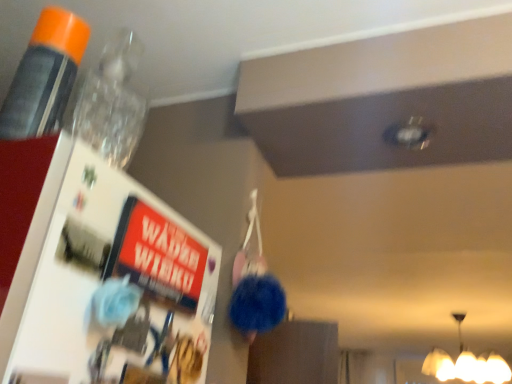
Question: Is matte white lampshade at lower right spatially inside orange cap plastic bottle at upper left, or outside of it?

Choices:
 (A) outside
 (B) inside

Answer: (A)

Question: Considering the positions of point (420, 370) and point (49, 107), is point (420, 370) closer or farther from the camera than point (49, 107)?

Choices:
 (A) closer
 (B) farther

Answer: (B)

Question: Looking at their shapes, would you say matte white lampshade at lower right is wider or thinner than orange cap plastic bottle at upper left?

Choices:
 (A) thin
 (B) wide

Answer: (B)

Question: Is orange cap plastic bottle at upper left wider or thinner than matte white lampshade at lower right?

Choices:
 (A) thin
 (B) wide

Answer: (A)

Question: From the image's perspective, is orange cap plastic bottle at upper left positioned above or below matte white lampshade at lower right?

Choices:
 (A) above
 (B) below

Answer: (A)

Question: In terms of height, does orange cap plastic bottle at upper left look taller or shorter compared to matte white lampshade at lower right?

Choices:
 (A) tall
 (B) short

Answer: (B)

Question: Do you think orange cap plastic bottle at upper left is within matte white lampshade at lower right, or outside of it?

Choices:
 (A) inside
 (B) outside

Answer: (B)